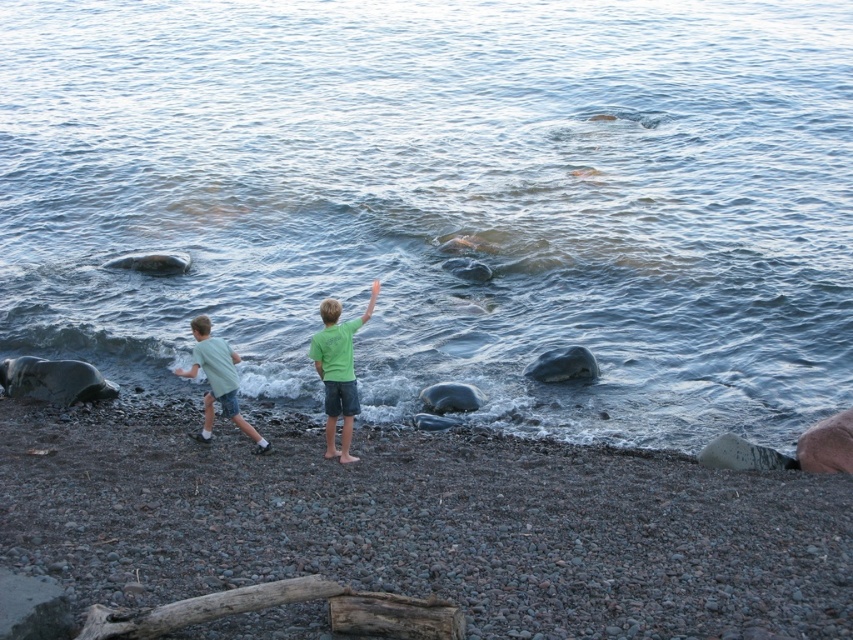
Is point (695, 445) behind point (91, 484)?

Yes.

Image resolution: width=853 pixels, height=640 pixels. What do you see at coordinates (445, 200) in the screenshot?
I see `clear water at center` at bounding box center [445, 200].

Locate an element on the screen. Image resolution: width=853 pixels, height=640 pixels. clear water at center is located at coordinates (445, 200).

Does clear water at center have a smaller size compared to green matte shirt at center?

Actually, clear water at center might be larger than green matte shirt at center.

Is clear water at center wider than green matte shirt at center?

Yes.

Between point (418, 154) and point (334, 385), which one is positioned behind?

The point (418, 154) is behind.

This screenshot has height=640, width=853. Find the location of `clear water at center`. clear water at center is located at coordinates (445, 200).

This screenshot has width=853, height=640. In order to click on clear water at center in this screenshot , I will do `click(445, 200)`.

Locate an element on the screen. clear water at center is located at coordinates (445, 200).